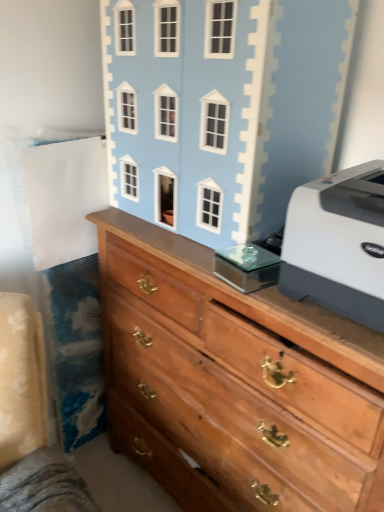
Question: Is white plastic printer at right in front of wooden chest of drawers at center?

Choices:
 (A) no
 (B) yes

Answer: (A)

Question: Considering the relative sizes of white plastic printer at right and wooden chest of drawers at center in the image provided, is white plastic printer at right thinner than wooden chest of drawers at center?

Choices:
 (A) no
 (B) yes

Answer: (B)

Question: From the image's perspective, would you say white plastic printer at right is shown under wooden chest of drawers at center?

Choices:
 (A) yes
 (B) no

Answer: (B)

Question: Is white plastic printer at right positioned behind wooden chest of drawers at center?

Choices:
 (A) no
 (B) yes

Answer: (B)

Question: Is white plastic printer at right outside of wooden chest of drawers at center?

Choices:
 (A) no
 (B) yes

Answer: (B)

Question: Is white plastic printer at right taller than wooden chest of drawers at center?

Choices:
 (A) yes
 (B) no

Answer: (B)

Question: From a real-world perspective, is light blue painted wood dollhouse at upper center physically above white plastic printer at right?

Choices:
 (A) no
 (B) yes

Answer: (B)

Question: Is light blue painted wood dollhouse at upper center far from white plastic printer at right?

Choices:
 (A) no
 (B) yes

Answer: (A)

Question: From the image's perspective, is light blue painted wood dollhouse at upper center on white plastic printer at right?

Choices:
 (A) no
 (B) yes

Answer: (B)

Question: Is light blue painted wood dollhouse at upper center facing towards white plastic printer at right?

Choices:
 (A) no
 (B) yes

Answer: (A)

Question: Can you confirm if light blue painted wood dollhouse at upper center is positioned to the right of white plastic printer at right?

Choices:
 (A) yes
 (B) no

Answer: (B)

Question: Considering the relative sizes of light blue painted wood dollhouse at upper center and white plastic printer at right in the image provided, is light blue painted wood dollhouse at upper center wider than white plastic printer at right?

Choices:
 (A) no
 (B) yes

Answer: (A)

Question: Is wooden chest of drawers at center positioned behind white plastic printer at right?

Choices:
 (A) no
 (B) yes

Answer: (A)